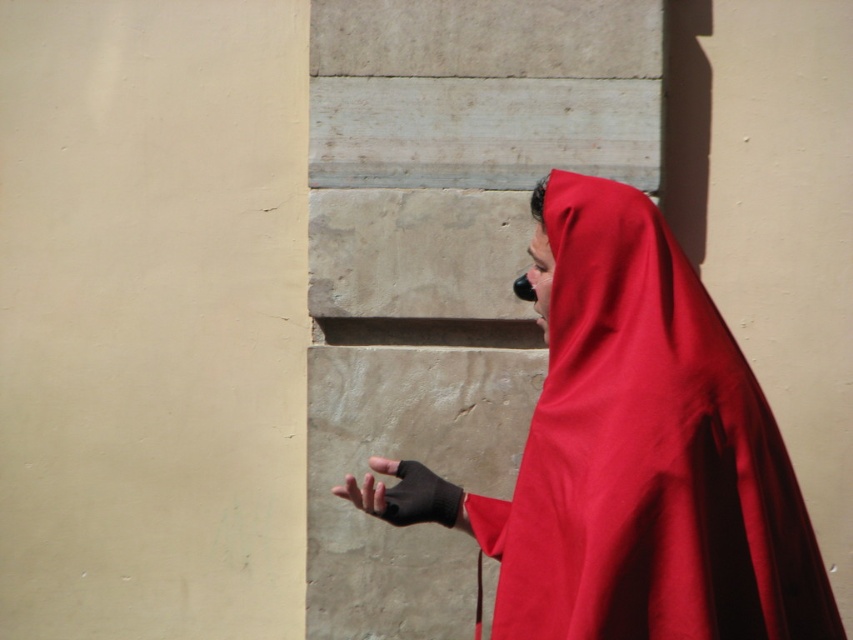
Does matte red cloak at right come in front of black matte glove at center?

Yes.

Describe the element at coordinates (646, 456) in the screenshot. The width and height of the screenshot is (853, 640). I see `matte red cloak at right` at that location.

The image size is (853, 640). I want to click on matte red cloak at right, so click(646, 456).